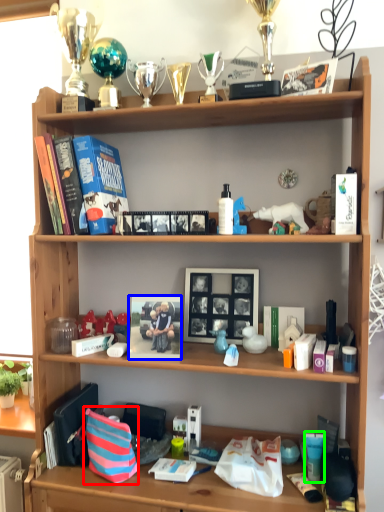
Question: Which object is the farthest from shopping bag (highlighted by a red box)? Choose among these: book cover (highlighted by a blue box) or toiletry (highlighted by a green box).

Choices:
 (A) book cover
 (B) toiletry

Answer: (B)